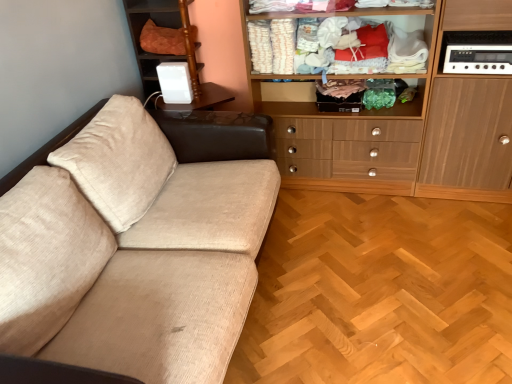
The image size is (512, 384). I want to click on orange quilted cushion at upper left, so click(162, 39).

What do you see at coordinates (468, 141) in the screenshot? The width and height of the screenshot is (512, 384). I see `light brown wood cabinet at right, placed as the second cabinetry when sorted from left to right` at bounding box center [468, 141].

What do you see at coordinates (175, 82) in the screenshot? This screenshot has width=512, height=384. I see `white plastic device at upper right, which is the first appliance in left-to-right order` at bounding box center [175, 82].

What is the approximate width of wooden cabinet at upper right, the second cabinetry viewed from the right?

17.40 inches.

Locate an element on the screen. The image size is (512, 384). orange quilted cushion at upper left is located at coordinates click(x=162, y=39).

From a real-world perspective, which object stands above the other?

In real-world perspective, orange quilted cushion at upper left is above.

Which of these two, orange quilted cushion at upper left or wooden cabinet at upper right, marked as the first cabinetry in a left-to-right arrangement, is smaller?

Smaller between the two is orange quilted cushion at upper left.

From the image's perspective, does orange quilted cushion at upper left appear higher than wooden cabinet at upper right, marked as the first cabinetry in a left-to-right arrangement?

Indeed, from the image's perspective, orange quilted cushion at upper left is shown above wooden cabinet at upper right, marked as the first cabinetry in a left-to-right arrangement.

From the image's perspective, which object appears higher, light brown wood cabinet at right, placed as the second cabinetry when sorted from left to right, or wooden cabinet at upper right, marked as the first cabinetry in a left-to-right arrangement?

wooden cabinet at upper right, marked as the first cabinetry in a left-to-right arrangement, from the image's perspective.

Measure the distance between light brown wood cabinet at right, placed as the second cabinetry when sorted from left to right, and wooden cabinet at upper right, the second cabinetry viewed from the right.

They are 4.68 inches apart.

Between light brown wood cabinet at right, placed as the second cabinetry when sorted from left to right, and wooden cabinet at upper right, the second cabinetry viewed from the right, which one has smaller size?

With smaller size is light brown wood cabinet at right, placed as the second cabinetry when sorted from left to right.

From a real-world perspective, which is physically above, light brown wood cabinet at right, placed as the second cabinetry when sorted from left to right, or orange quilted cushion at upper left?

In real-world perspective, orange quilted cushion at upper left is above.

Considering the relative sizes of light brown wood cabinet at right, placed as the second cabinetry when sorted from left to right, and orange quilted cushion at upper left in the image provided, is light brown wood cabinet at right, placed as the second cabinetry when sorted from left to right, shorter than orange quilted cushion at upper left?

In fact, light brown wood cabinet at right, placed as the second cabinetry when sorted from left to right, may be taller than orange quilted cushion at upper left.

From the image's perspective, is light brown wood cabinet at right, placed as the second cabinetry when sorted from left to right, above orange quilted cushion at upper left?

No, from the image's perspective, light brown wood cabinet at right, placed as the second cabinetry when sorted from left to right, is not over orange quilted cushion at upper left.

Can you confirm if wooden cabinet at upper right, the second cabinetry viewed from the right, is taller than orange quilted cushion at upper left?

Indeed, wooden cabinet at upper right, the second cabinetry viewed from the right, has a greater height compared to orange quilted cushion at upper left.

Based on the photo, between wooden cabinet at upper right, the second cabinetry viewed from the right, and orange quilted cushion at upper left, which one has smaller size?

Smaller between the two is orange quilted cushion at upper left.

Which object is wider, wooden cabinet at upper right, marked as the first cabinetry in a left-to-right arrangement, or orange quilted cushion at upper left?

wooden cabinet at upper right, marked as the first cabinetry in a left-to-right arrangement.

Measure the distance from wooden cabinet at upper right, marked as the first cabinetry in a left-to-right arrangement, to orange quilted cushion at upper left.

The distance of wooden cabinet at upper right, marked as the first cabinetry in a left-to-right arrangement, from orange quilted cushion at upper left is 1.12 meters.

Can you confirm if white plastic device at upper right, which appears as the 1th appliance when viewed from the back, is wider than white plastic stereo at upper right, positioned as the 1th appliance in front-to-back order?

No, white plastic device at upper right, which appears as the 1th appliance when viewed from the back, is not wider than white plastic stereo at upper right, positioned as the 1th appliance in front-to-back order.

Considering the positions of objects white plastic device at upper right, which is counted as the 2th appliance, starting from the front, and white plastic stereo at upper right, acting as the first appliance starting from the right, in the image provided, who is in front, white plastic device at upper right, which is counted as the 2th appliance, starting from the front, or white plastic stereo at upper right, acting as the first appliance starting from the right,?

white plastic stereo at upper right, acting as the first appliance starting from the right, is closer to the camera.

Considering the sizes of objects white plastic device at upper right, which appears as the 1th appliance when viewed from the back, and white plastic stereo at upper right, marked as the second appliance in a left-to-right arrangement, in the image provided, who is taller, white plastic device at upper right, which appears as the 1th appliance when viewed from the back, or white plastic stereo at upper right, marked as the second appliance in a left-to-right arrangement,?

white plastic device at upper right, which appears as the 1th appliance when viewed from the back.

Which is more to the left, white plastic device at upper right, which is counted as the 2th appliance, starting from the front, or white plastic stereo at upper right, the 2th appliance positioned from the back?

Positioned to the left is white plastic device at upper right, which is counted as the 2th appliance, starting from the front.

Is white plastic device at upper right, the second appliance viewed from the right, not near light brown wood cabinet at right, the 1th cabinetry in the right-to-left sequence?

Absolutely, white plastic device at upper right, the second appliance viewed from the right, is distant from light brown wood cabinet at right, the 1th cabinetry in the right-to-left sequence.

Would you say white plastic device at upper right, which appears as the 1th appliance when viewed from the back, is outside light brown wood cabinet at right, placed as the second cabinetry when sorted from left to right?

white plastic device at upper right, which appears as the 1th appliance when viewed from the back, is positioned outside light brown wood cabinet at right, placed as the second cabinetry when sorted from left to right.

From the picture: Considering the relative positions of white plastic device at upper right, which is the first appliance in left-to-right order, and light brown wood cabinet at right, placed as the second cabinetry when sorted from left to right, in the image provided, is white plastic device at upper right, which is the first appliance in left-to-right order, in front of light brown wood cabinet at right, placed as the second cabinetry when sorted from left to right,?

No, white plastic device at upper right, which is the first appliance in left-to-right order, is behind light brown wood cabinet at right, placed as the second cabinetry when sorted from left to right.

Would you consider white plastic stereo at upper right, acting as the first appliance starting from the right, to be distant from light brown wood cabinet at right, the 1th cabinetry in the right-to-left sequence?

No.

Which is behind, point (445, 66) or point (493, 101)?

The point (493, 101) is farther from the camera.

From a real-world perspective, is white plastic stereo at upper right, positioned as the 1th appliance in front-to-back order, on light brown wood cabinet at right, the 1th cabinetry in the right-to-left sequence?

Correct, in the physical world, white plastic stereo at upper right, positioned as the 1th appliance in front-to-back order, is higher than light brown wood cabinet at right, the 1th cabinetry in the right-to-left sequence.

How distant is white plastic stereo at upper right, positioned as the 1th appliance in front-to-back order, from light brown wood cabinet at right, the 1th cabinetry in the right-to-left sequence?

white plastic stereo at upper right, positioned as the 1th appliance in front-to-back order, and light brown wood cabinet at right, the 1th cabinetry in the right-to-left sequence, are 11.39 inches apart from each other.

The width and height of the screenshot is (512, 384). Identify the location of clothing above the wooden cabinet at upper right, the second cabinetry viewed from the right (from the image's perspective). coord(162,39).

Find the location of a particular element. The image size is (512, 384). cabinetry on the left of the light brown wood cabinet at right, the 1th cabinetry in the right-to-left sequence is located at coordinates (412, 128).

When comparing their distances from orange quilted cushion at upper left, does white plastic device at upper right, the second appliance viewed from the right, or wooden cabinet at upper right, the second cabinetry viewed from the right, seem further?

wooden cabinet at upper right, the second cabinetry viewed from the right, lies further to orange quilted cushion at upper left than the other object.

Which object lies nearer to the anchor point light brown wood cabinet at right, placed as the second cabinetry when sorted from left to right, orange quilted cushion at upper left or white plastic stereo at upper right, positioned as the 1th appliance in front-to-back order?

white plastic stereo at upper right, positioned as the 1th appliance in front-to-back order, is closer to light brown wood cabinet at right, placed as the second cabinetry when sorted from left to right.

Based on their spatial positions, is white plastic stereo at upper right, positioned as the 1th appliance in front-to-back order, or wooden cabinet at upper right, the second cabinetry viewed from the right, closer to white plastic device at upper right, which is the first appliance in left-to-right order?

Among the two, wooden cabinet at upper right, the second cabinetry viewed from the right, is located nearer to white plastic device at upper right, which is the first appliance in left-to-right order.

Considering their positions, is orange quilted cushion at upper left positioned closer to white plastic stereo at upper right, marked as the second appliance in a left-to-right arrangement, than white plastic device at upper right, which is the first appliance in left-to-right order?

white plastic device at upper right, which is the first appliance in left-to-right order, lies closer to white plastic stereo at upper right, marked as the second appliance in a left-to-right arrangement, than the other object.

Which object lies nearer to the anchor point wooden cabinet at upper right, the second cabinetry viewed from the right, light brown wood cabinet at right, placed as the second cabinetry when sorted from left to right, or white plastic stereo at upper right, acting as the first appliance starting from the right?

light brown wood cabinet at right, placed as the second cabinetry when sorted from left to right, is positioned closer to the anchor wooden cabinet at upper right, the second cabinetry viewed from the right.

Considering their positions, is orange quilted cushion at upper left positioned closer to white plastic device at upper right, which appears as the 1th appliance when viewed from the back, than wooden cabinet at upper right, marked as the first cabinetry in a left-to-right arrangement?

orange quilted cushion at upper left.

Estimate the real-world distances between objects in this image. Which object is further from white plastic stereo at upper right, the 2th appliance positioned from the back, white plastic device at upper right, which appears as the 1th appliance when viewed from the back, or wooden cabinet at upper right, the second cabinetry viewed from the right?

Among the two, white plastic device at upper right, which appears as the 1th appliance when viewed from the back, is located further to white plastic stereo at upper right, the 2th appliance positioned from the back.

From the image, which object appears to be farther from white plastic device at upper right, which is the first appliance in left-to-right order, light brown wood cabinet at right, placed as the second cabinetry when sorted from left to right, or white plastic stereo at upper right, marked as the second appliance in a left-to-right arrangement?

Among the two, light brown wood cabinet at right, placed as the second cabinetry when sorted from left to right, is located further to white plastic device at upper right, which is the first appliance in left-to-right order.

At what (x,y) coordinates should I click in order to perform the action: click on cabinetry located between orange quilted cushion at upper left and light brown wood cabinet at right, placed as the second cabinetry when sorted from left to right, in the left-right direction. Please return your answer as a coordinate pair (x, y). Image resolution: width=512 pixels, height=384 pixels. Looking at the image, I should click on (412, 128).

Locate an element on the screen. appliance located between white plastic device at upper right, the second appliance viewed from the right, and light brown wood cabinet at right, the 1th cabinetry in the right-to-left sequence, in the left-right direction is located at coordinates (477, 52).

Find the location of a particular element. appliance between orange quilted cushion at upper left and white plastic stereo at upper right, the 2th appliance positioned from the back, in the horizontal direction is located at coordinates (175, 82).

Locate an element on the screen. This screenshot has height=384, width=512. appliance located between wooden cabinet at upper right, the second cabinetry viewed from the right, and light brown wood cabinet at right, the 1th cabinetry in the right-to-left sequence, in the left-right direction is located at coordinates (477, 52).